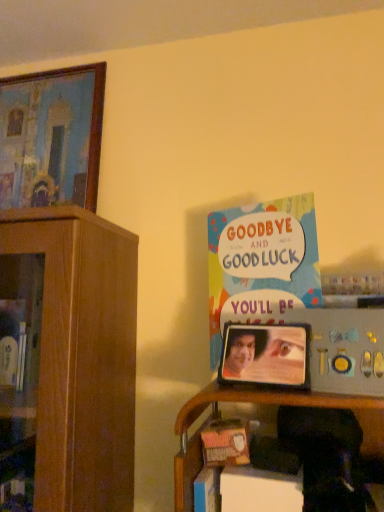
What do you see at coordinates (51, 137) in the screenshot? This screenshot has width=384, height=512. I see `wooden painted picture frame at upper left, the second picture frame in the front-to-back sequence` at bounding box center [51, 137].

This screenshot has width=384, height=512. In order to click on multicolored paper card at upper right in this screenshot , I will do `click(261, 264)`.

Is metallic silver picture frame at center, which appears as the second picture frame when viewed from the back, inside or outside of multicolored paper card at upper right?

metallic silver picture frame at center, which appears as the second picture frame when viewed from the back, exists outside the volume of multicolored paper card at upper right.

From the image's perspective, between metallic silver picture frame at center, the first picture frame from the bottom, and multicolored paper card at upper right, who is located below?

From the image's view, metallic silver picture frame at center, the first picture frame from the bottom, is below.

From a real-world perspective, is metallic silver picture frame at center, the second picture frame viewed from the left, below multicolored paper card at upper right?

Yes, from a real-world perspective, metallic silver picture frame at center, the second picture frame viewed from the left, is beneath multicolored paper card at upper right.

Identify the location of the 2nd picture frame counting from the left of the wooden shelf at lower right. This screenshot has height=512, width=384. (51, 137).

Is wooden shelf at lower right inside the boundaries of wooden painted picture frame at upper left, which ranks as the 1th picture frame in back-to-front order, or outside?

wooden shelf at lower right is located beyond the bounds of wooden painted picture frame at upper left, which ranks as the 1th picture frame in back-to-front order.

From the image's perspective, is wooden shelf at lower right located above or below wooden painted picture frame at upper left, which ranks as the 1th picture frame in back-to-front order?

Clearly, from the image's perspective, wooden shelf at lower right is below wooden painted picture frame at upper left, which ranks as the 1th picture frame in back-to-front order.

From the image's perspective, does wooden shelf at lower right appear higher than metallic silver picture frame at center, which appears as the second picture frame when viewed from the back?

No.

How many degrees apart are the facing directions of wooden shelf at lower right and metallic silver picture frame at center, the second picture frame viewed from the left?

11.1 degrees separate the facing orientations of wooden shelf at lower right and metallic silver picture frame at center, the second picture frame viewed from the left.

Can you confirm if wooden shelf at lower right is positioned to the right of metallic silver picture frame at center, the second picture frame viewed from the left?

Correct, you'll find wooden shelf at lower right to the right of metallic silver picture frame at center, the second picture frame viewed from the left.

Considering the sizes of objects wooden shelf at lower right and metallic silver picture frame at center, the first picture frame from the front, in the image provided, who is wider, wooden shelf at lower right or metallic silver picture frame at center, the first picture frame from the front,?

wooden shelf at lower right is wider.

Does wooden painted picture frame at upper left, the second picture frame in the front-to-back sequence, appear on the right side of metallic silver picture frame at center, which appears as the second picture frame when viewed from the back?

Incorrect, wooden painted picture frame at upper left, the second picture frame in the front-to-back sequence, is not on the right side of metallic silver picture frame at center, which appears as the second picture frame when viewed from the back.

Could you tell me if wooden painted picture frame at upper left, which ranks as the 1th picture frame in back-to-front order, is facing metallic silver picture frame at center, the first picture frame in the right-to-left sequence?

No, wooden painted picture frame at upper left, which ranks as the 1th picture frame in back-to-front order, is not oriented towards metallic silver picture frame at center, the first picture frame in the right-to-left sequence.

Is wooden painted picture frame at upper left, which is counted as the first picture frame, starting from the top, directly adjacent to metallic silver picture frame at center, the first picture frame in the right-to-left sequence?

wooden painted picture frame at upper left, which is counted as the first picture frame, starting from the top, and metallic silver picture frame at center, the first picture frame in the right-to-left sequence, are not in contact.

Who is shorter, wooden painted picture frame at upper left, marked as the 2th picture frame in a right-to-left arrangement, or metallic silver picture frame at center, the first picture frame from the bottom?

Standing shorter between the two is metallic silver picture frame at center, the first picture frame from the bottom.

Is multicolored paper card at upper right to the left of metallic silver picture frame at center, the first picture frame in the right-to-left sequence, from the viewer's perspective?

No.

Between multicolored paper card at upper right and metallic silver picture frame at center, the first picture frame in the right-to-left sequence, which one has less height?

Standing shorter between the two is metallic silver picture frame at center, the first picture frame in the right-to-left sequence.

Is multicolored paper card at upper right aimed at metallic silver picture frame at center, the first picture frame from the front?

Yes, multicolored paper card at upper right is facing metallic silver picture frame at center, the first picture frame from the front.

From the image's perspective, relative to metallic silver picture frame at center, the second picture frame viewed from the left, is multicolored paper card at upper right above or below?

Clearly, from the image's perspective, multicolored paper card at upper right is above metallic silver picture frame at center, the second picture frame viewed from the left.

Does multicolored paper card at upper right turn towards wooden shelf at lower right?

No.

Is the depth of multicolored paper card at upper right greater than that of wooden shelf at lower right?

Yes, multicolored paper card at upper right is behind wooden shelf at lower right.

This screenshot has width=384, height=512. In order to click on shelf that appears on the left of multicolored paper card at upper right in this screenshot , I will do `click(240, 402)`.

Is wooden shelf at lower right located within multicolored paper card at upper right?

No.

From the image's perspective, which one is positioned higher, metallic silver picture frame at center, the first picture frame in the right-to-left sequence, or wooden shelf at lower right?

metallic silver picture frame at center, the first picture frame in the right-to-left sequence, from the image's perspective.

In the scene shown: Can you confirm if metallic silver picture frame at center, which appears as the second picture frame when viewed from the back, is wider than wooden shelf at lower right?

No.

Between metallic silver picture frame at center, the second picture frame viewed from the left, and wooden shelf at lower right, which one appears on the left side from the viewer's perspective?

Positioned to the left is metallic silver picture frame at center, the second picture frame viewed from the left.

Find the location of a particular element. This screenshot has width=384, height=512. picture frame in front of the multicolored paper card at upper right is located at coordinates (265, 355).

You are a GUI agent. You are given a task and a screenshot of the screen. Output one action in this format:
    pyautogui.click(x=<x>, y=<y>)
    Task: Click on the picture frame that is the 2nd object to the left of the wooden shelf at lower right, starting at the anchor
    This screenshot has width=384, height=512.
    Given the screenshot: What is the action you would take?
    coord(51,137)

Looking at the image, which one is located further to multicolored paper card at upper right, wooden painted picture frame at upper left, which is the second picture frame in bottom-to-top order, or metallic silver picture frame at center, the second picture frame viewed from the left?

Based on the image, wooden painted picture frame at upper left, which is the second picture frame in bottom-to-top order, appears to be further to multicolored paper card at upper right.

Based on their spatial positions, is metallic silver picture frame at center, the first picture frame from the front, or multicolored paper card at upper right closer to wooden painted picture frame at upper left, which is counted as the first picture frame, starting from the top?

multicolored paper card at upper right is positioned closer to the anchor wooden painted picture frame at upper left, which is counted as the first picture frame, starting from the top.

Estimate the real-world distances between objects in this image. Which object is closer to wooden painted picture frame at upper left, which ranks as the 1th picture frame in back-to-front order, multicolored paper card at upper right or wooden shelf at lower right?

multicolored paper card at upper right is closer to wooden painted picture frame at upper left, which ranks as the 1th picture frame in back-to-front order.

When comparing their distances from multicolored paper card at upper right, does metallic silver picture frame at center, the first picture frame from the bottom, or wooden painted picture frame at upper left, which is the second picture frame in bottom-to-top order, seem closer?

metallic silver picture frame at center, the first picture frame from the bottom.

Which object lies further to the anchor point wooden shelf at lower right, multicolored paper card at upper right or metallic silver picture frame at center, the second picture frame viewed from the left?

Among the two, multicolored paper card at upper right is located further to wooden shelf at lower right.

Estimate the real-world distances between objects in this image. Which object is closer to multicolored paper card at upper right, wooden shelf at lower right or metallic silver picture frame at center, the second picture frame viewed from the left?

The object closer to multicolored paper card at upper right is metallic silver picture frame at center, the second picture frame viewed from the left.

Considering their positions, is multicolored paper card at upper right positioned further to wooden painted picture frame at upper left, which is counted as the first picture frame, starting from the left, than metallic silver picture frame at center, the first picture frame from the front?

metallic silver picture frame at center, the first picture frame from the front, is positioned further to the anchor wooden painted picture frame at upper left, which is counted as the first picture frame, starting from the left.

Looking at the image, which one is located closer to wooden shelf at lower right, metallic silver picture frame at center, the first picture frame from the front, or multicolored paper card at upper right?

Among the two, metallic silver picture frame at center, the first picture frame from the front, is located nearer to wooden shelf at lower right.

This screenshot has width=384, height=512. Identify the location of picture frame between wooden painted picture frame at upper left, the second picture frame in the front-to-back sequence, and multicolored paper card at upper right from left to right. (265, 355).

Locate an element on the screen. This screenshot has height=512, width=384. picture frame that lies between wooden painted picture frame at upper left, the second picture frame in the front-to-back sequence, and wooden shelf at lower right from top to bottom is located at coordinates (265, 355).

What are the coordinates of `book between wooden painted picture frame at upper left, which is the second picture frame in bottom-to-top order, and wooden shelf at lower right, in the vertical direction` in the screenshot? It's located at (261, 264).

The height and width of the screenshot is (512, 384). What are the coordinates of `picture frame that lies between multicolored paper card at upper right and wooden shelf at lower right from top to bottom` in the screenshot? It's located at (265, 355).